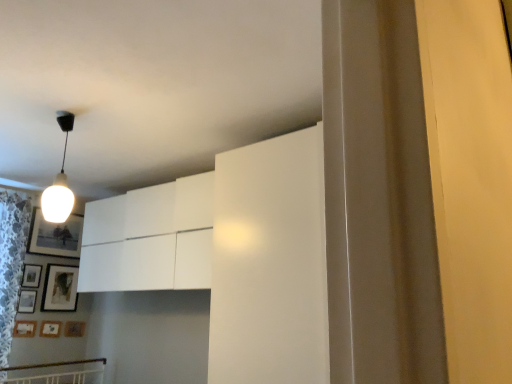
Question: Can you confirm if matte black picture frame at upper left, acting as the first picture frame starting from the top, is positioned to the right of white glossy light bulb at upper left?

Choices:
 (A) no
 (B) yes

Answer: (A)

Question: Could you tell me if matte black picture frame at upper left, the seventh picture frame ordered from the bottom, is turned towards white glossy light bulb at upper left?

Choices:
 (A) yes
 (B) no

Answer: (A)

Question: Considering the relative sizes of matte black picture frame at upper left, the seventh picture frame ordered from the bottom, and white glossy light bulb at upper left in the image provided, is matte black picture frame at upper left, the seventh picture frame ordered from the bottom, bigger than white glossy light bulb at upper left?

Choices:
 (A) yes
 (B) no

Answer: (B)

Question: Considering the relative sizes of matte black picture frame at upper left, acting as the first picture frame starting from the top, and white glossy light bulb at upper left in the image provided, is matte black picture frame at upper left, acting as the first picture frame starting from the top, taller than white glossy light bulb at upper left?

Choices:
 (A) no
 (B) yes

Answer: (A)

Question: From the image's perspective, is matte black picture frame at upper left, acting as the first picture frame starting from the top, below white glossy light bulb at upper left?

Choices:
 (A) yes
 (B) no

Answer: (A)

Question: From a real-world perspective, is white lace curtain at left physically located above or below wooden picture frame at lower left, the fourth picture frame when ordered from bottom to top?

Choices:
 (A) below
 (B) above

Answer: (B)

Question: In terms of width, does white lace curtain at left look wider or thinner when compared to wooden picture frame at lower left, the fourth picture frame when ordered from bottom to top?

Choices:
 (A) thin
 (B) wide

Answer: (B)

Question: In the image, is white lace curtain at left on the left side or the right side of wooden picture frame at lower left, arranged as the 4th picture frame when viewed from the top?

Choices:
 (A) right
 (B) left

Answer: (B)

Question: Do you think white lace curtain at left is within wooden picture frame at lower left, the fourth picture frame when ordered from bottom to top, or outside of it?

Choices:
 (A) inside
 (B) outside

Answer: (B)

Question: From the image's perspective, is white glossy light bulb at upper left located above or below wooden matte picture frame at lower left, placed as the seventh picture frame when sorted from top to bottom?

Choices:
 (A) below
 (B) above

Answer: (B)

Question: From their relative heights in the image, would you say white glossy light bulb at upper left is taller or shorter than wooden matte picture frame at lower left, placed as the seventh picture frame when sorted from top to bottom?

Choices:
 (A) short
 (B) tall

Answer: (B)

Question: Considering the positions of point (69, 193) and point (68, 329), is point (69, 193) closer or farther from the camera than point (68, 329)?

Choices:
 (A) farther
 (B) closer

Answer: (B)

Question: Is white glossy light bulb at upper left in front of or behind wooden matte picture frame at lower left, arranged as the 1th picture frame when ordered from the bottom, in the image?

Choices:
 (A) behind
 (B) front

Answer: (B)

Question: Looking at the image, does wooden picture frame at lower left, arranged as the 4th picture frame when viewed from the top, seem bigger or smaller compared to wooden matte picture frame at lower left, which is the 5th picture frame in top-to-bottom order?

Choices:
 (A) small
 (B) big

Answer: (B)

Question: From the image's perspective, relative to wooden matte picture frame at lower left, the 3th picture frame positioned from the bottom, is wooden picture frame at lower left, arranged as the 4th picture frame when viewed from the top, above or below?

Choices:
 (A) above
 (B) below

Answer: (A)